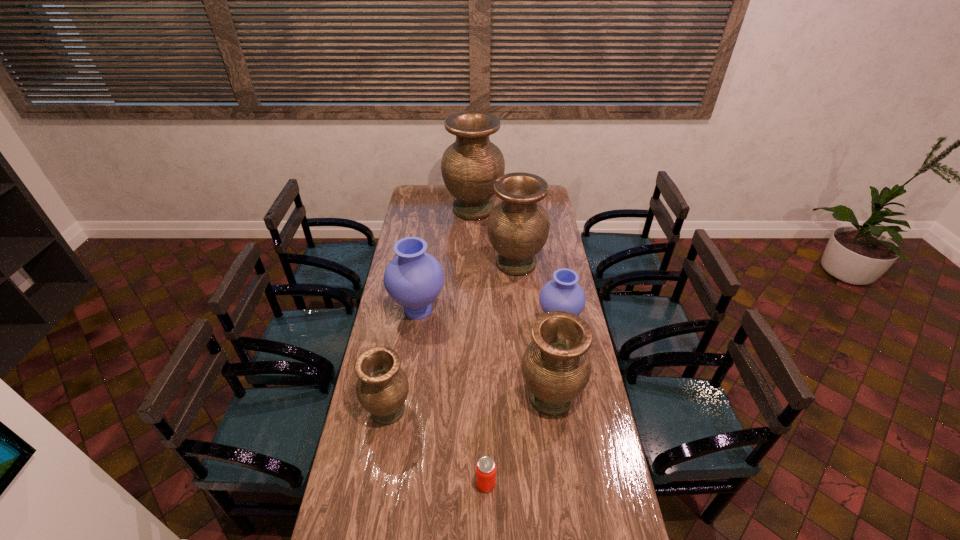
This screenshot has height=540, width=960. In order to click on unoccupied area between the sixth nearest object and the leftmost green vase in this screenshot , I will do `click(452, 337)`.

Where is `vacant point located between the second smallest green vase and the smallest green vase`? The image size is (960, 540). vacant point located between the second smallest green vase and the smallest green vase is located at coordinates pyautogui.click(x=469, y=403).

This screenshot has width=960, height=540. Identify the location of unoccupied position between the leftmost green vase and the shortest object. (437, 447).

Identify the location of vacant space that's between the nearest object and the second farthest vase. This screenshot has width=960, height=540. (501, 374).

In order to click on free area in between the second smallest green vase and the tallest object in this screenshot , I will do pos(512,303).

Locate an element on the screen. The height and width of the screenshot is (540, 960). vacant space that is in between the left blue vase and the smaller blue vase is located at coordinates point(489,316).

What are the coordinates of `free spot between the right blue vase and the beer can` in the screenshot? It's located at (522, 403).

Locate an element on the screen. The image size is (960, 540). object that stands as the closest to the farthest vase is located at coordinates coord(518,227).

Identify which object is the fourth closest to the biggest green vase. Please provide its 2D coordinates. Your answer should be formatted as a tuple, i.e. [(x, y)], where the tuple contains the x and y coordinates of a point satisfying the conditions above.

[(556, 367)]

Where is `the second closest vase relative to the leftmost green vase`? This screenshot has height=540, width=960. the second closest vase relative to the leftmost green vase is located at coordinates (556, 367).